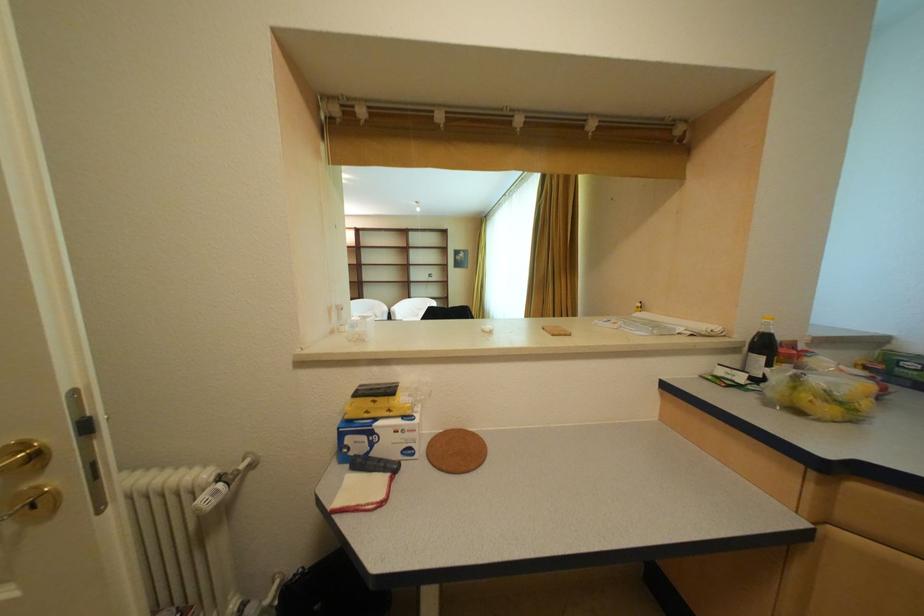
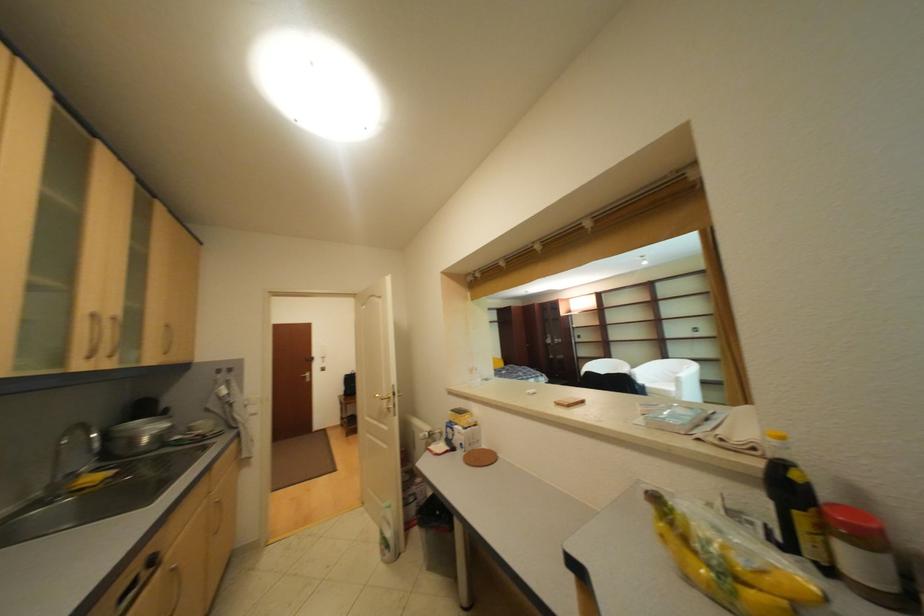
Locate, in the second image, the point that corresponds to the point at 407,432 in the first image.

(469, 434)